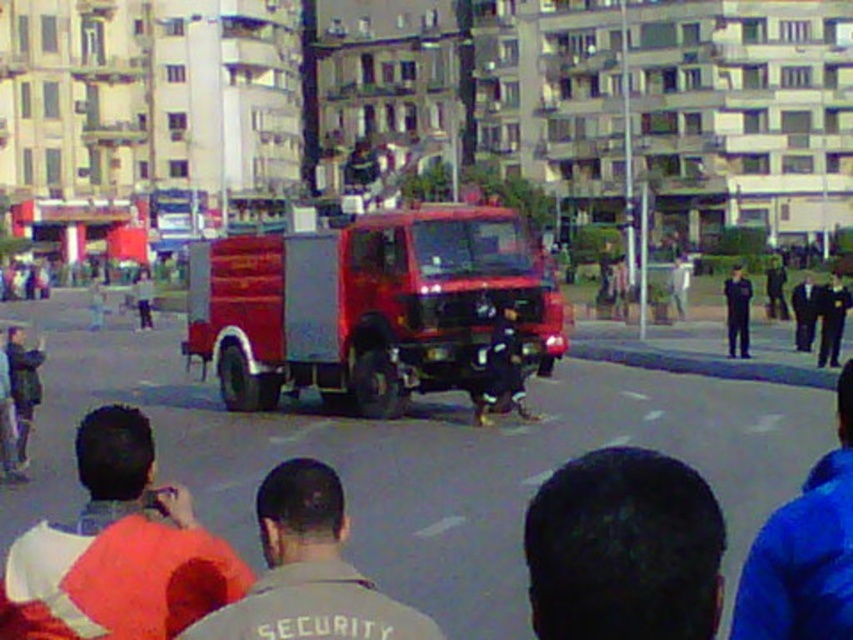
You are standing at the point marked by the coordinates point (x=308, y=572). Looking around, you see the gray fabric security guard at center and the red fire truck in the middle of the street. Which object is closer to you?

The gray fabric security guard at center is closer to you because the point (x=308, y=572) indicates the gray fabric security guard at center.

You are a photographer trying to capture a clear shot of the gray fabric security guard at center and the blue fabric jacket at lower right. Which of the two subjects is narrower in width?

The gray fabric security guard at center is thinner than the blue fabric jacket at lower right, so the gray fabric security guard at center is narrower in width.

You are a photographer trying to capture a clear shot of the dark hair at center and the gray fabric security guard at center. Based on their widths, which one might require you to adjust your camera focus to a wider angle to fit entirely in the frame?

The dark hair at center has a smaller width than the gray fabric security guard at center, so the gray fabric security guard at center would require a wider angle to fit entirely in the frame.